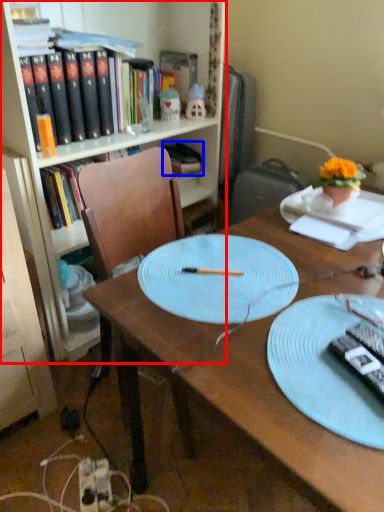
Question: Which point is further to the camera, bookcase (highlighted by a red box) or book (highlighted by a blue box)?

Choices:
 (A) bookcase
 (B) book

Answer: (B)